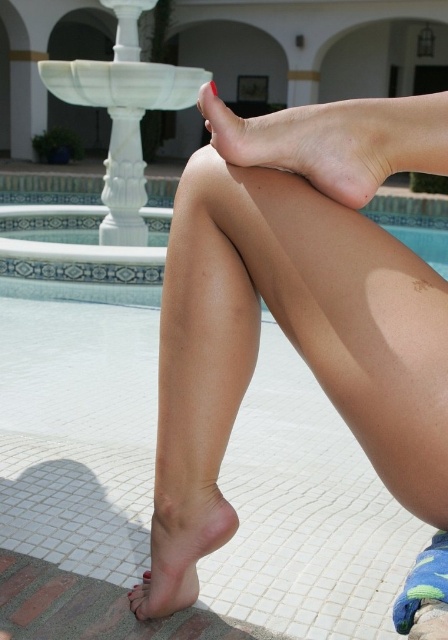
Looking at this image, you are a lifeguard observing the scene from the poolside. You see the blue tile swimming pool at center and the matte pink toe at lower left. Which object is located above the other?

The blue tile swimming pool at center is positioned over matte pink toe at lower left, so the pool is above the toe.

You are a photographer adjusting your camera to focus on the smooth skin legs at center and the smooth skin foot at center in the poolside image. Which object should you adjust the focus on first if you want to capture the one that is closer to the camera?

The smooth skin legs at center are closer to the camera than the smooth skin foot at center, so you should focus on the smooth skin legs at center first.